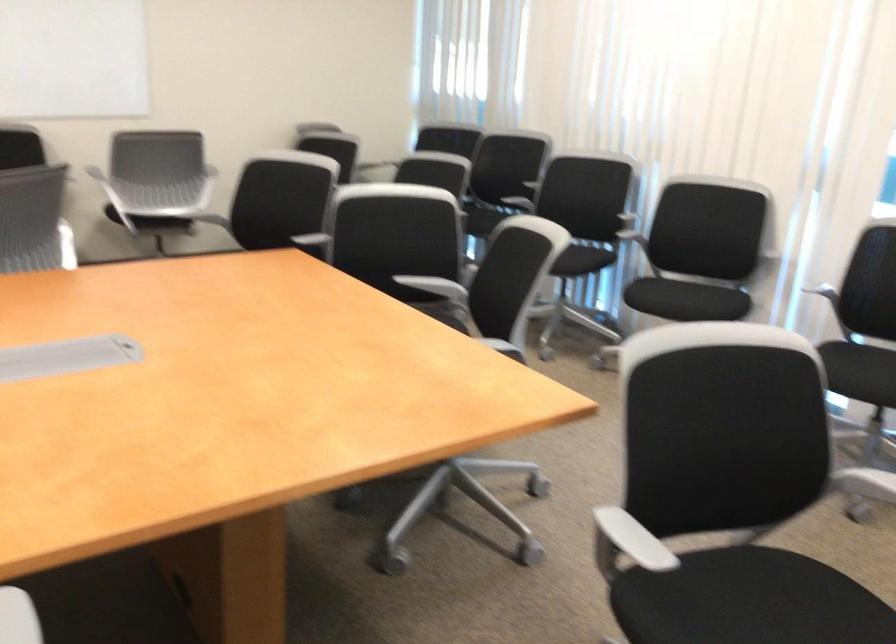
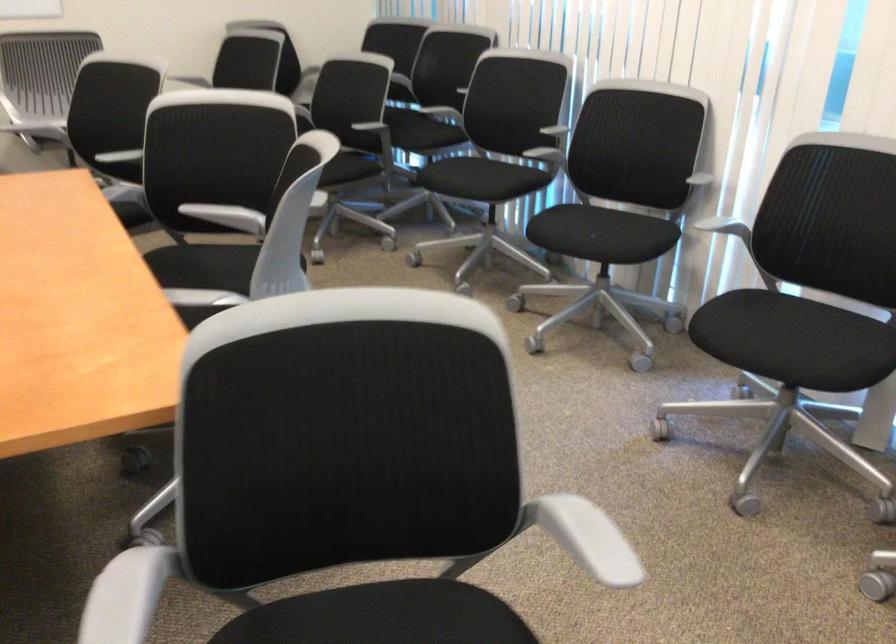
Where in the second image is the point corresponding to pixel 679 292 from the first image?

(582, 232)